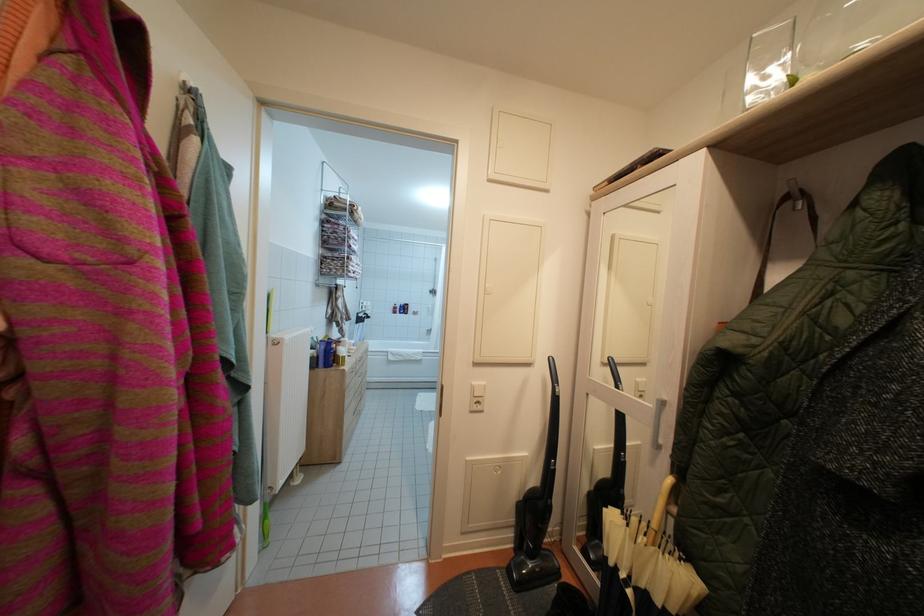
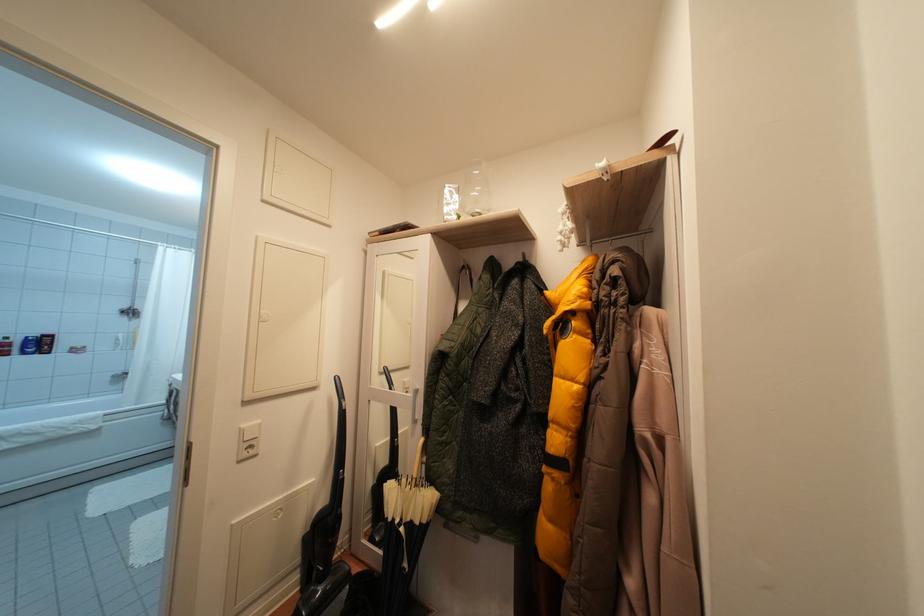
Find the pixel in the second image that matches point 480,389 in the first image.

(250, 431)